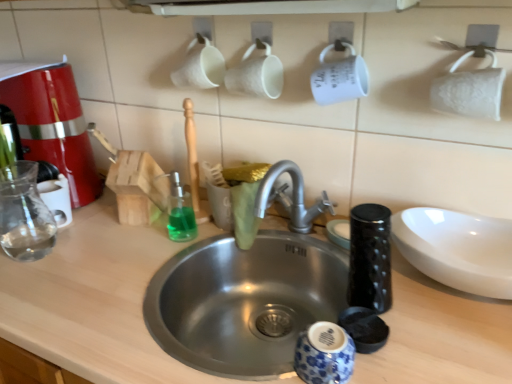
Question: Considering the positions of point (168, 372) and point (48, 155), is point (168, 372) closer or farther from the camera than point (48, 155)?

Choices:
 (A) closer
 (B) farther

Answer: (A)

Question: From the image's perspective, is stainless steel sink at center located above or below matte red coffee machine at left?

Choices:
 (A) above
 (B) below

Answer: (B)

Question: Which object is the farthest from the stainless steel sink at center?

Choices:
 (A) clear glass mug at left
 (B) matte red coffee machine at left
 (C) green translucent liquid at sink
 (D) stainless steel sink at center
 (E) transparent glass bottle at left

Answer: (A)

Question: Based on their relative distances, which object is farther from the stainless steel sink at center?

Choices:
 (A) stainless steel sink at center
 (B) white lace toilet paper at upper right
 (C) clear glass mug at left
 (D) green translucent liquid at sink
 (E) transparent glass bottle at left

Answer: (B)